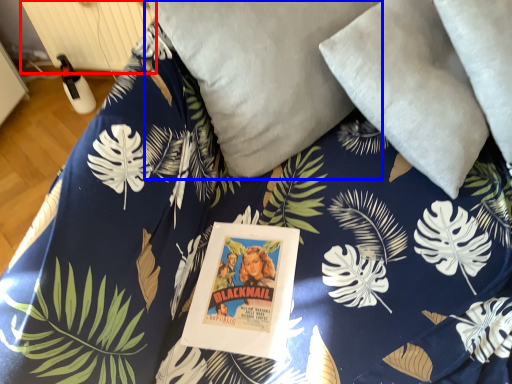
Question: Which object is closer to the camera taking this photo, radiator (highlighted by a red box) or pillow (highlighted by a blue box)?

Choices:
 (A) radiator
 (B) pillow

Answer: (B)